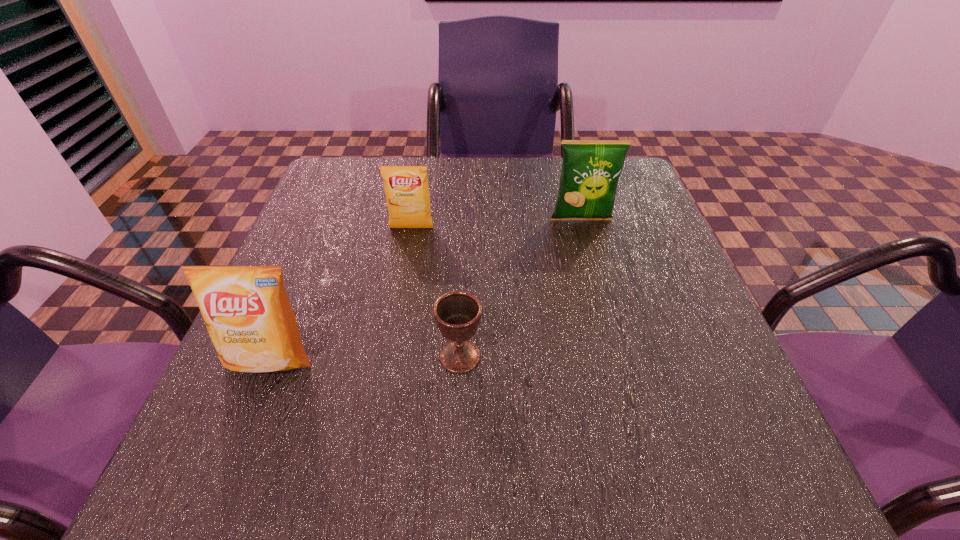
The width and height of the screenshot is (960, 540). In order to click on the rightmost crisp (potato chip) in this screenshot , I will do `click(590, 171)`.

Locate an element on the screen. This screenshot has height=540, width=960. the nearest crisp (potato chip) is located at coordinates (246, 310).

I want to click on the leftmost object, so click(x=246, y=310).

Find the location of `the second crisp (potato chip) from right to left`. the second crisp (potato chip) from right to left is located at coordinates (406, 188).

This screenshot has height=540, width=960. In order to click on the third tallest object in this screenshot , I will do `click(406, 188)`.

What are the coordinates of `chalice` in the screenshot? It's located at (457, 314).

I want to click on the shortest object, so click(457, 314).

Where is `free spot located on the front-facing side of the rightmost object`? The height and width of the screenshot is (540, 960). free spot located on the front-facing side of the rightmost object is located at coordinates (589, 249).

This screenshot has width=960, height=540. Identify the location of vacant space located on the front-facing side of the leftmost object. (237, 441).

I want to click on vacant space located on the front of the second crisp (potato chip) from left to right with the logo, so click(397, 305).